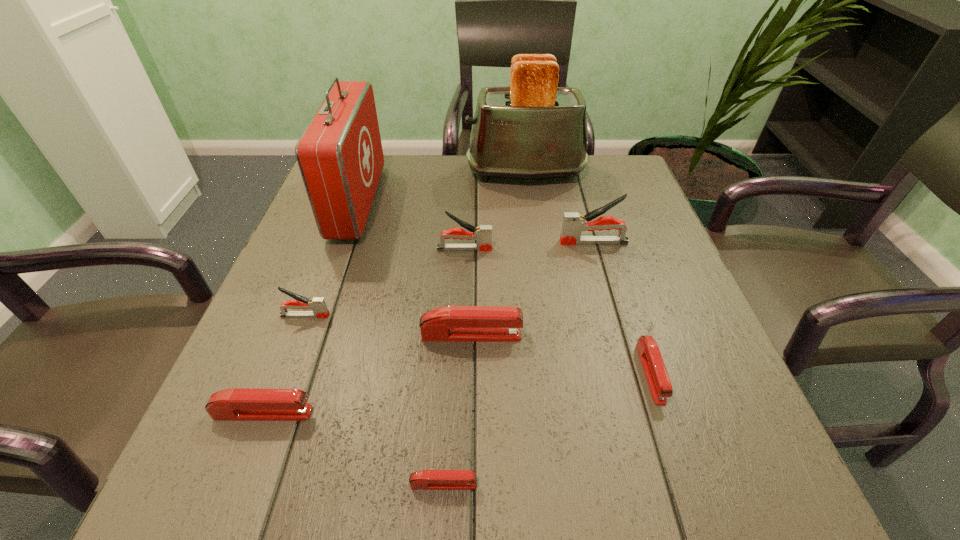
Where is `gray toaster`? gray toaster is located at coordinates (533, 129).

This screenshot has width=960, height=540. Find the location of `the first-aid kit`. the first-aid kit is located at coordinates (340, 156).

Locate an element on the screen. This screenshot has width=960, height=540. the tallest stapler is located at coordinates (573, 224).

Image resolution: width=960 pixels, height=540 pixels. I want to click on the rightmost gray stapler, so click(x=573, y=224).

The width and height of the screenshot is (960, 540). I want to click on the sixth shortest object, so click(x=483, y=235).

You are a GUI agent. You are given a task and a screenshot of the screen. Output one action in this format:
    pyautogui.click(x=<x>, y=<y>)
    Task: Click on the second tallest stapler
    
    Given the screenshot: What is the action you would take?
    pyautogui.click(x=483, y=235)

The height and width of the screenshot is (540, 960). In order to click on the fifth nearest object in this screenshot , I will do `click(318, 306)`.

The image size is (960, 540). In order to click on the smallest gray stapler in this screenshot , I will do `click(318, 306)`.

Identify the location of the sixth farthest object. (449, 323).

Locate an element on the screen. Image resolution: width=960 pixels, height=540 pixels. the farthest red stapler is located at coordinates point(449,323).